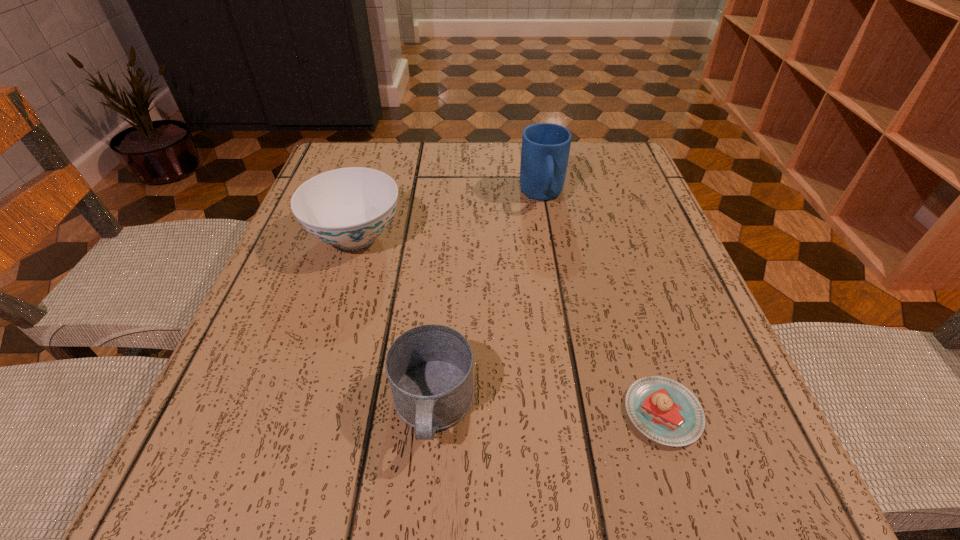
The height and width of the screenshot is (540, 960). What are the coordinates of `object at the far edge` in the screenshot? It's located at (545, 149).

The width and height of the screenshot is (960, 540). I want to click on mug that is at the near edge, so [430, 368].

Where is `pastry present at the near edge`? This screenshot has width=960, height=540. pastry present at the near edge is located at coordinates (665, 411).

Identify the location of object that is at the left edge. (349, 208).

Locate an element on the screen. object that is at the right edge is located at coordinates pyautogui.click(x=665, y=411).

In order to click on object that is at the near right corner in this screenshot , I will do `click(665, 411)`.

This screenshot has height=540, width=960. In the image, there is a desktop. In order to click on vacant region at the far edge in this screenshot , I will do `click(477, 164)`.

Identify the location of free location at the near edge of the desktop. This screenshot has width=960, height=540. (435, 488).

Where is `vacant space at the left edge`? This screenshot has height=540, width=960. vacant space at the left edge is located at coordinates (320, 352).

Image resolution: width=960 pixels, height=540 pixels. In the image, there is a desktop. Identify the location of vacant space at the right edge. (676, 360).